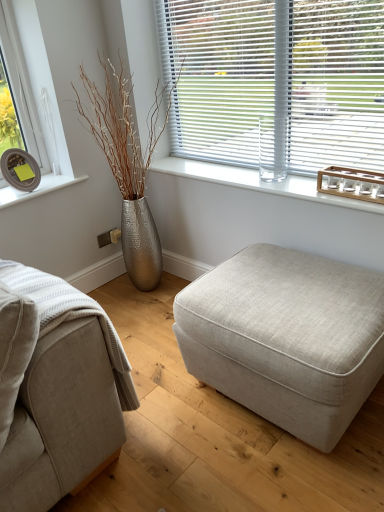
You are a GUI agent. You are given a task and a screenshot of the screen. Output one action in this format:
    pyautogui.click(x=<x>, y=<y>)
    Task: Click on the free point above clear glass at upper center (from a real-world perspective)
    
    Given the screenshot: What is the action you would take?
    pyautogui.click(x=240, y=176)